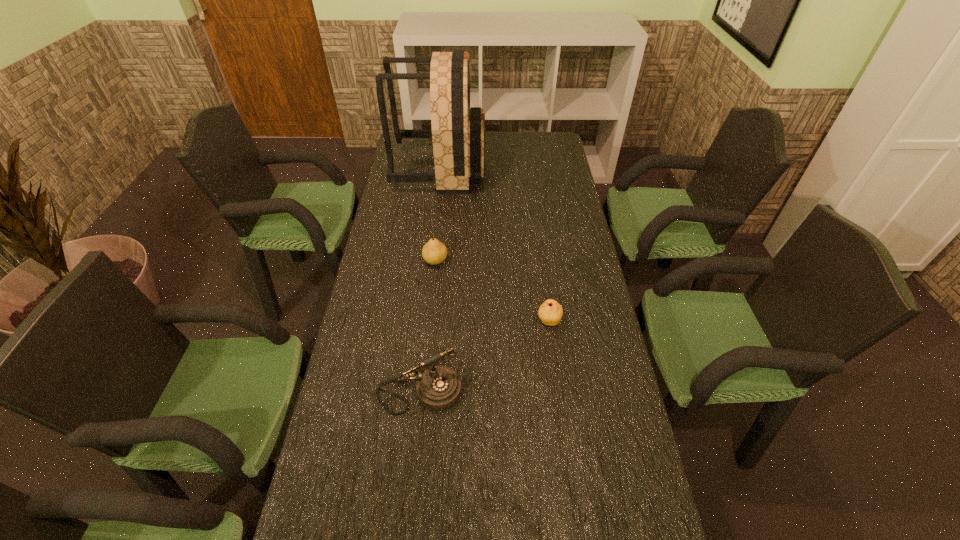
At what (x,y) coordinates should I click in order to perform the action: click on vacant region that satisfies the following two spatial constraints: 1. on the front face of the farthest object; 2. on the right side of the second nearest object. Please return your answer as a coordinate pair (x, y). The image size is (960, 540). Looking at the image, I should click on (422, 321).

Locate an element on the screen. free space that satisfies the following two spatial constraints: 1. on the front face of the telephone; 2. on the left side of the backpack is located at coordinates (414, 392).

This screenshot has width=960, height=540. I want to click on free region that satisfies the following two spatial constraints: 1. on the front face of the second farthest object; 2. on the right side of the farthest object, so click(429, 261).

Where is `vacant space that satisfies the following two spatial constraints: 1. on the front face of the tallest object; 2. on the right side of the nearest object`? The image size is (960, 540). vacant space that satisfies the following two spatial constraints: 1. on the front face of the tallest object; 2. on the right side of the nearest object is located at coordinates (414, 392).

The image size is (960, 540). Find the location of `vacant area that satisfies the following two spatial constraints: 1. on the front face of the farthest object; 2. on the back side of the left pear`. vacant area that satisfies the following two spatial constraints: 1. on the front face of the farthest object; 2. on the back side of the left pear is located at coordinates (429, 261).

Where is `free spot that satisfies the following two spatial constraints: 1. on the back side of the rightmost object; 2. on the front face of the farthest object`? free spot that satisfies the following two spatial constraints: 1. on the back side of the rightmost object; 2. on the front face of the farthest object is located at coordinates (528, 168).